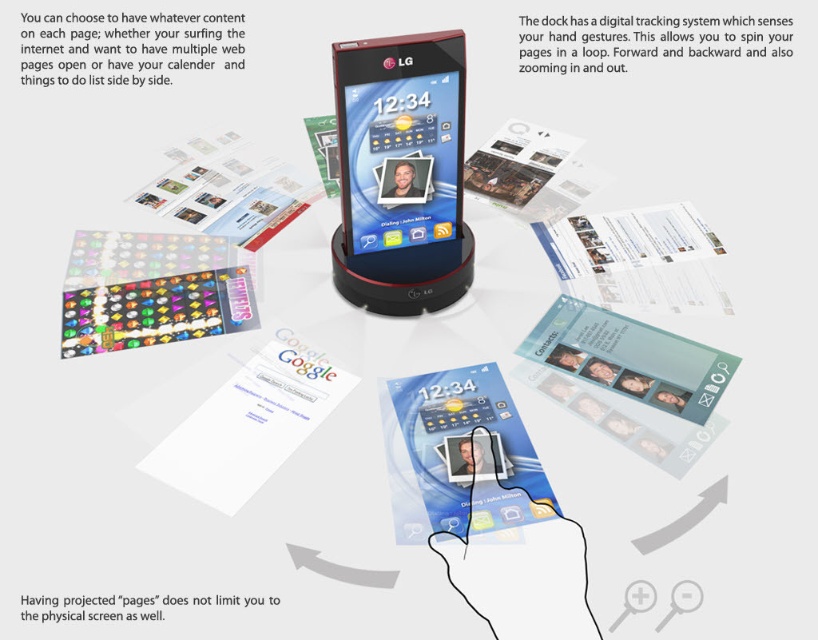
Who is positioned more to the right, matte black phone at center or matte plastic card game at center?

Positioned to the right is matte plastic card game at center.

Consider the image. Can you confirm if matte black phone at center is wider than matte plastic card game at center?

Yes, matte black phone at center is wider than matte plastic card game at center.

The image size is (818, 640). I want to click on matte black phone at center, so click(x=401, y=172).